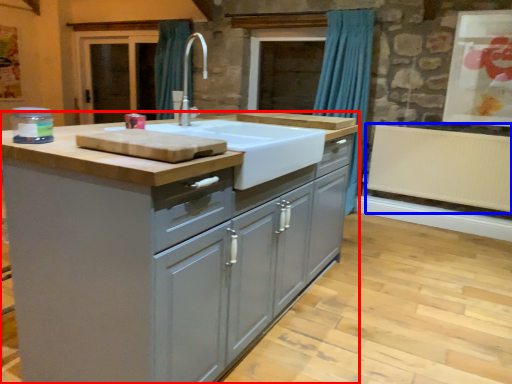
Question: Which point is closer to the camera, cabinetry (highlighted by a red box) or radiator (highlighted by a blue box)?

Choices:
 (A) cabinetry
 (B) radiator

Answer: (A)